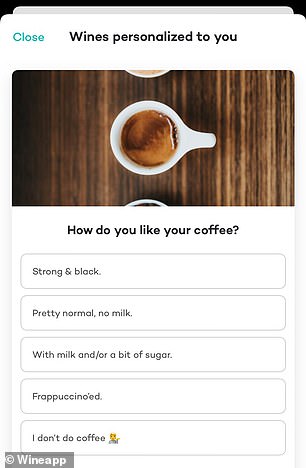
Where is `counter or table wood`? counter or table wood is located at coordinates (231, 172).